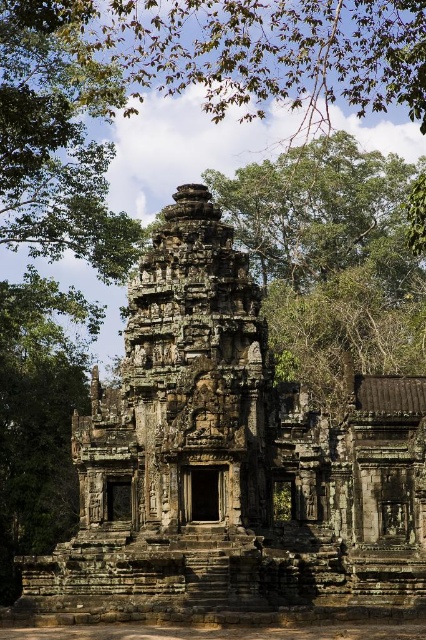
You are standing at the entrance of the ancient stone temple and see two points marked in the scene. The first point is at coordinates point [285,589] and the second is at point [54,68]. Which point is closer to you as you face the temple?

Point [285,589] is closer to you because it is in front of point [54,68].

You are a tourist standing at the entrance of the temple complex. You want to take a photo of the gray stone temple at center from a specific spot. If your camera can only focus on objects within a 0.5 unit radius from the point you are standing, where should you position yourself to ensure the temple is in focus? Use the coordinates provided in the description.

You should position yourself at coordinates approximately around the gray stone temple at center located at point (230,465) to ensure it falls within the camera focus range of 0.5 units. Since the temple is at (230,465), standing within 0.5 units from that point will keep it in focus.